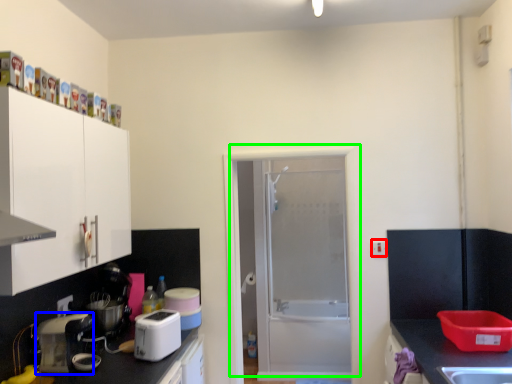
Question: Which object is positioned closest to electric outlet (highlighted by a red box)? Select from kitchen appliance (highlighted by a blue box) and door (highlighted by a green box).

Choices:
 (A) kitchen appliance
 (B) door

Answer: (B)